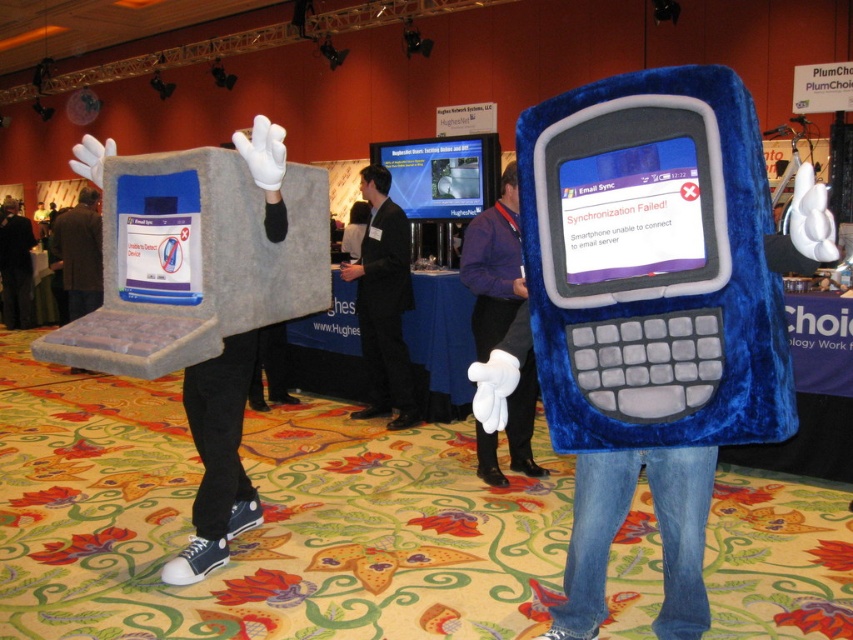
You are standing at the origin point in the image. Where is the gray felt laptop at left located in terms of coordinates?

The gray felt laptop at left is located at coordinates point (218, 458).

You are a photographer at the event and want to capture both the gray felt laptop at left and the black suit at center in a single photo. Based on their positions, where should you position yourself to ensure both are visible in the frame?

You should position yourself so that you are looking upward toward the black suit at center, as the gray felt laptop at left is below it, ensuring both are within the frame.

You are a photographer at the event and need to arrange the gray felt laptop at left and the blue plush phone at center for a photo. If you want to place them side by side so that the thinner one is on the left, which object should be positioned where?

The gray felt laptop at left is thinner than the blue plush phone at center, so to have the thinner one on the left, the gray felt laptop at left should be placed on the left and the blue plush phone at center on the right.